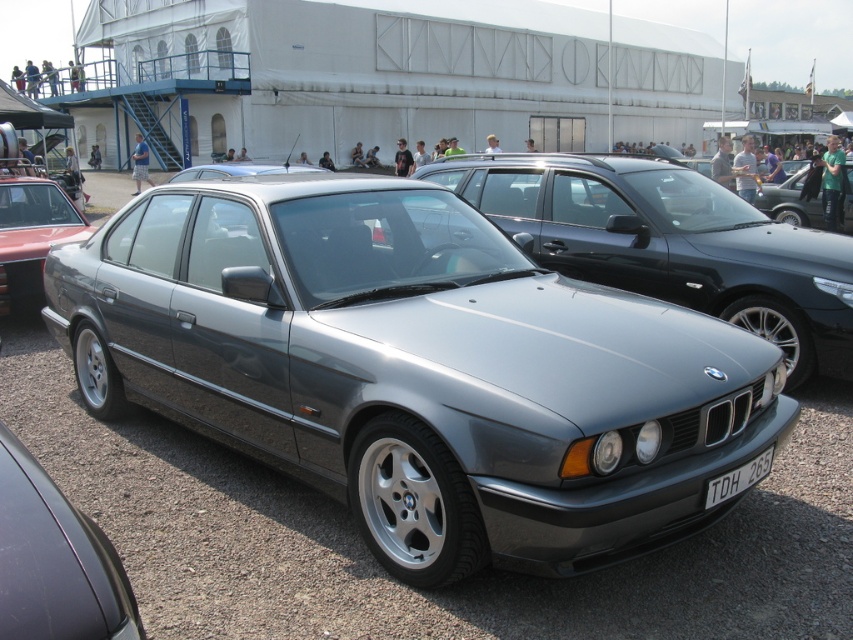
Question: Which point is closer to the camera?

Choices:
 (A) (38, 518)
 (B) (431, 166)
 (C) (73, 353)
 (D) (16, 193)

Answer: (A)

Question: Among these objects, which one is nearest to the camera?

Choices:
 (A) satin metallic car at center
 (B) satin silver car at center
 (C) satin metallic sedan at center

Answer: (A)

Question: Is satin black car at center positioned behind white plastic license plate at lower center?

Choices:
 (A) yes
 (B) no

Answer: (B)

Question: Can you confirm if satin metallic sedan at center is positioned to the left of satin silver car at center?

Choices:
 (A) yes
 (B) no

Answer: (A)

Question: Which object appears farthest from the camera in this image?

Choices:
 (A) satin black car at center
 (B) white plastic license plate at lower center

Answer: (B)

Question: Is metallic gray sedan at left bigger than satin silver car at center?

Choices:
 (A) yes
 (B) no

Answer: (B)